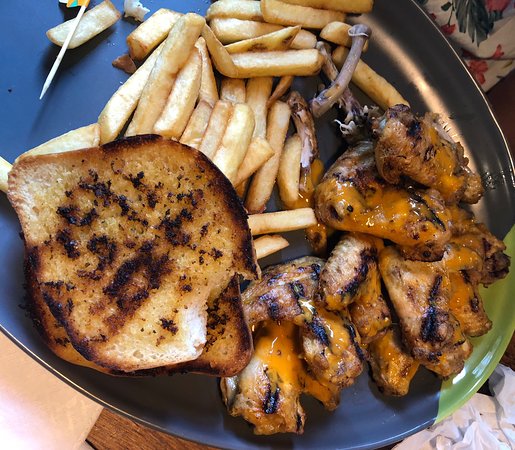
Identify the location of the back cloth. (477, 27).